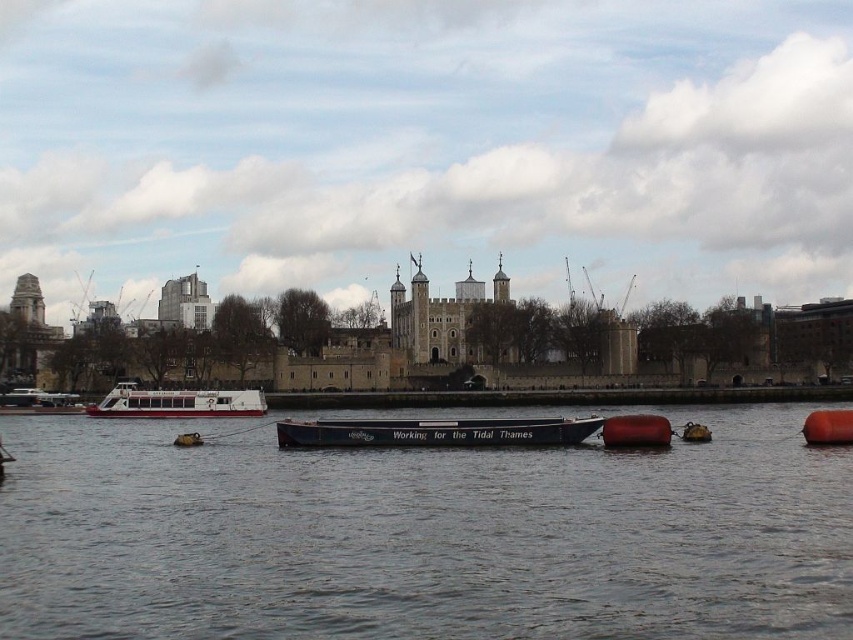
Question: Can you confirm if black rubber boat at center is bigger than rubber buoy at center?

Choices:
 (A) yes
 (B) no

Answer: (A)

Question: Does black matte boat at center lie behind orange rubber buoy at lower right?

Choices:
 (A) yes
 (B) no

Answer: (A)

Question: Can you confirm if black rubber boat at center is positioned to the left of white matte boat at center?

Choices:
 (A) no
 (B) yes

Answer: (A)

Question: Which point is closer to the camera?

Choices:
 (A) white matte boat at left
 (B) orange rubber buoy at lower right

Answer: (B)

Question: Which object is closer to the camera taking this photo?

Choices:
 (A) rubber buoy at center
 (B) white matte boat at left
 (C) black matte boat at center

Answer: (A)

Question: Which object appears farthest from the camera in this image?

Choices:
 (A) orange rubber buoy at lower right
 (B) white matte boat at center
 (C) black rubber boat at center
 (D) white matte boat at left

Answer: (D)